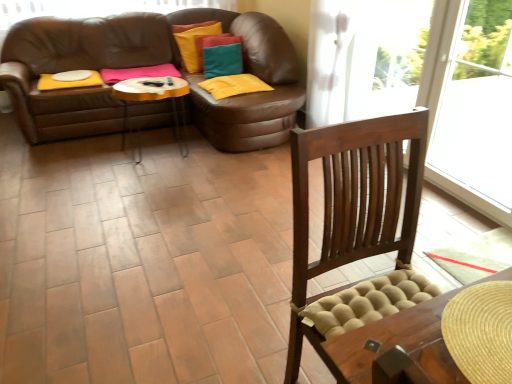
The width and height of the screenshot is (512, 384). What do you see at coordinates (247, 117) in the screenshot? I see `brown leather footrest at center` at bounding box center [247, 117].

Identify the location of brown leather footrest at center. (247, 117).

Identify the location of brown leather couch at upper left. 148,65.

What do you see at coordinates (148, 65) in the screenshot? The width and height of the screenshot is (512, 384). I see `brown leather couch at upper left` at bounding box center [148, 65].

Locate an element on the screen. The width and height of the screenshot is (512, 384). brown leather footrest at center is located at coordinates (247, 117).

Can you confirm if brown leather footrest at center is positioned to the right of brown leather couch at upper left?

Yes, brown leather footrest at center is to the right of brown leather couch at upper left.

Between brown leather footrest at center and brown leather couch at upper left, which one is positioned behind?

brown leather couch at upper left.

Which is in front, point (220, 140) or point (284, 140)?

The point (220, 140) is more forward.

From the image's perspective, which object appears higher, brown leather footrest at center or brown leather couch at upper left?

brown leather couch at upper left appears higher in the image.

From a real-world perspective, is brown leather footrest at center physically above brown leather couch at upper left?

Correct, in the physical world, brown leather footrest at center is higher than brown leather couch at upper left.

Does brown leather footrest at center have a lesser width compared to brown leather couch at upper left?

Indeed, brown leather footrest at center has a lesser width compared to brown leather couch at upper left.

Looking at this image, can you confirm if brown leather footrest at center is taller than brown leather couch at upper left?

Incorrect, the height of brown leather footrest at center is not larger of that of brown leather couch at upper left.

Who is bigger, brown leather footrest at center or brown leather couch at upper left?

brown leather couch at upper left is bigger.

Choose the correct answer: Is brown leather footrest at center inside brown leather couch at upper left or outside it?

brown leather footrest at center exists outside the volume of brown leather couch at upper left.

From the picture: Are brown leather footrest at center and brown leather couch at upper left making contact?

There is a gap between brown leather footrest at center and brown leather couch at upper left.

Is brown leather footrest at center oriented away from brown leather couch at upper left?

brown leather footrest at center is not turned away from brown leather couch at upper left.

Find the location of a particular element. footrest on the right of brown leather couch at upper left is located at coordinates (247, 117).

Visually, is brown leather couch at upper left positioned to the left or to the right of brown leather footrest at center?

In the image, brown leather couch at upper left appears on the left side of brown leather footrest at center.

Does brown leather couch at upper left lie in front of brown leather footrest at center?

No, brown leather couch at upper left is further to the viewer.

Considering the points (289, 63) and (298, 103), which point is in front, point (289, 63) or point (298, 103)?

Positioned in front is point (298, 103).

From the image's perspective, is brown leather couch at upper left on top of brown leather footrest at center?

Correct, brown leather couch at upper left appears higher than brown leather footrest at center in the image.

From a real-world perspective, relative to brown leather footrest at center, is brown leather couch at upper left vertically above or below?

In terms of real-world spatial position, brown leather couch at upper left is below brown leather footrest at center.

Between brown leather couch at upper left and brown leather footrest at center, which one has larger width?

brown leather couch at upper left.

Who is taller, brown leather couch at upper left or brown leather footrest at center?

With more height is brown leather couch at upper left.

Which of these two, brown leather couch at upper left or brown leather footrest at center, is smaller?

Smaller between the two is brown leather footrest at center.

Is brown leather couch at upper left located outside brown leather footrest at center?

Yes.

Based on the photo, are brown leather couch at upper left and brown leather footrest at center far apart?

Actually, brown leather couch at upper left and brown leather footrest at center are a little close together.

Is brown leather couch at upper left turned away from brown leather footrest at center?

That's not correct — brown leather couch at upper left is not looking away from brown leather footrest at center.

How different are the orientations of brown leather couch at upper left and brown leather footrest at center in degrees?

180 degrees separate the facing orientations of brown leather couch at upper left and brown leather footrest at center.

Find the location of `footrest that is on the right side of brown leather couch at upper left`. footrest that is on the right side of brown leather couch at upper left is located at coordinates (247, 117).

Image resolution: width=512 pixels, height=384 pixels. I want to click on studio couch on the left of brown leather footrest at center, so click(148, 65).

Identify the location of the footrest located below the brown leather couch at upper left (from the image's perspective). (247, 117).